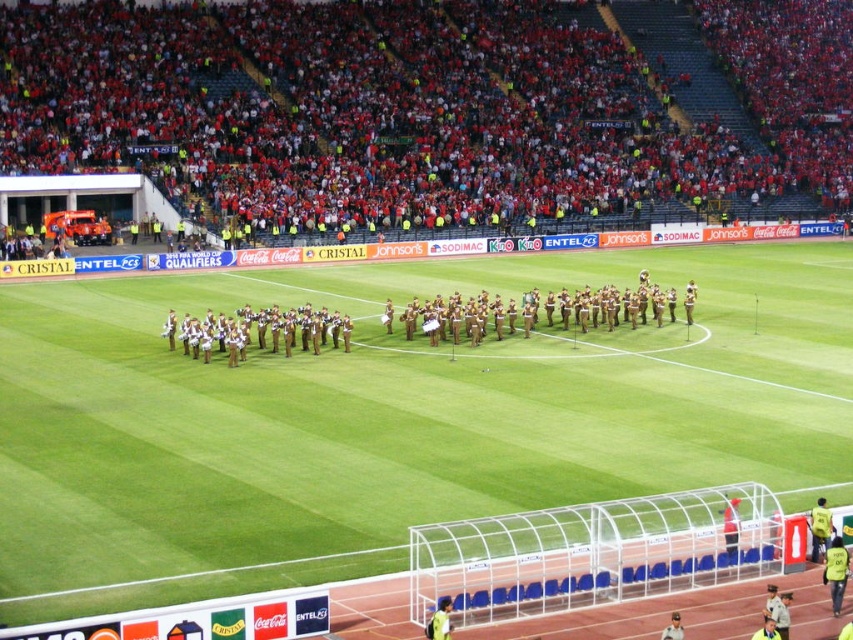
The image size is (853, 640). What do you see at coordinates (389, 417) in the screenshot? I see `green grass football field at center` at bounding box center [389, 417].

Based on the photo, does green grass football field at center have a greater height compared to red fabric crowd at upper center?

Incorrect, green grass football field at center's height is not larger of red fabric crowd at upper center's.

Which is behind, point (467, 288) or point (51, 68)?

The point (51, 68) is behind.

Where is `green grass football field at center`? The height and width of the screenshot is (640, 853). green grass football field at center is located at coordinates (389, 417).

Image resolution: width=853 pixels, height=640 pixels. Find the location of `red fabric crowd at upper center`. red fabric crowd at upper center is located at coordinates (439, 112).

Which of these two, red fabric crowd at upper center or brown uniformed band at center, stands taller?

With more height is red fabric crowd at upper center.

The height and width of the screenshot is (640, 853). I want to click on red fabric crowd at upper center, so click(x=439, y=112).

Where is `red fabric crowd at upper center`? red fabric crowd at upper center is located at coordinates coord(439,112).

Can you confirm if green grass football field at center is positioned below brown uniformed band at center?

Indeed, green grass football field at center is positioned under brown uniformed band at center.

Does point (97, 433) come behind point (556, 294)?

No, (97, 433) is closer to viewer.

Between point (496, 273) and point (616, 349), which one is positioned in front?

Positioned in front is point (616, 349).

The height and width of the screenshot is (640, 853). In order to click on green grass football field at center in this screenshot , I will do `click(389, 417)`.